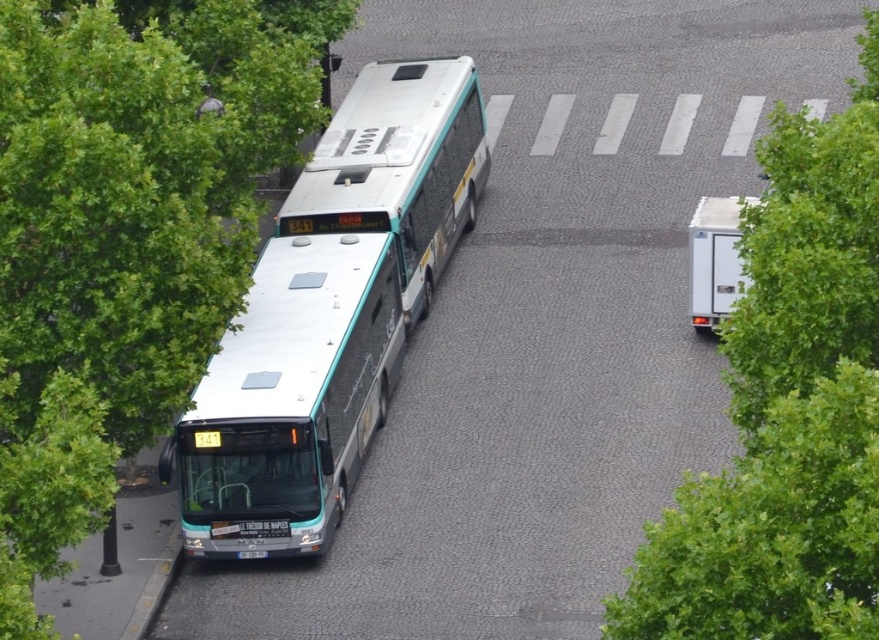
Who is higher up, white metallic bus at center or gray concrete curb at lower left?

Positioned higher is white metallic bus at center.

Is white metallic bus at center further to the viewer compared to gray concrete curb at lower left?

No, white metallic bus at center is in front of gray concrete curb at lower left.

Is point (273, 429) positioned in front of point (129, 632)?

No, (273, 429) is behind (129, 632).

At what (x,y) coordinates should I click in order to perform the action: click on white metallic bus at center. Please return your answer as a coordinate pair (x, y). The width and height of the screenshot is (879, 640). Looking at the image, I should click on click(x=331, y=314).

Which of these two, green leafy tree at left or gray concrete curb at lower left, stands taller?

green leafy tree at left is taller.

Is green leafy tree at left positioned behind gray concrete curb at lower left?

No, green leafy tree at left is closer to the viewer.

This screenshot has width=879, height=640. In order to click on green leafy tree at left in this screenshot , I will do `click(137, 188)`.

Measure the distance between green leafy tree at center right and camera.

52.20 feet

Between green leafy tree at center right and gray concrete curb at lower left, which one is positioned lower?

A: gray concrete curb at lower left

Does point (805, 534) come farther from viewer compared to point (162, 595)?

No, (805, 534) is closer to viewer.

This screenshot has width=879, height=640. Find the location of `green leafy tree at center right`. green leafy tree at center right is located at coordinates (787, 410).